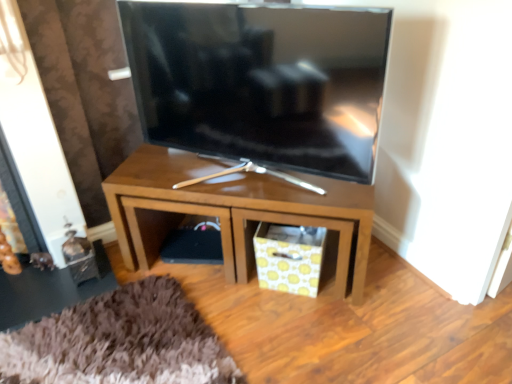
I want to click on free region under satin black tv at center (from a real-world perspective), so click(221, 176).